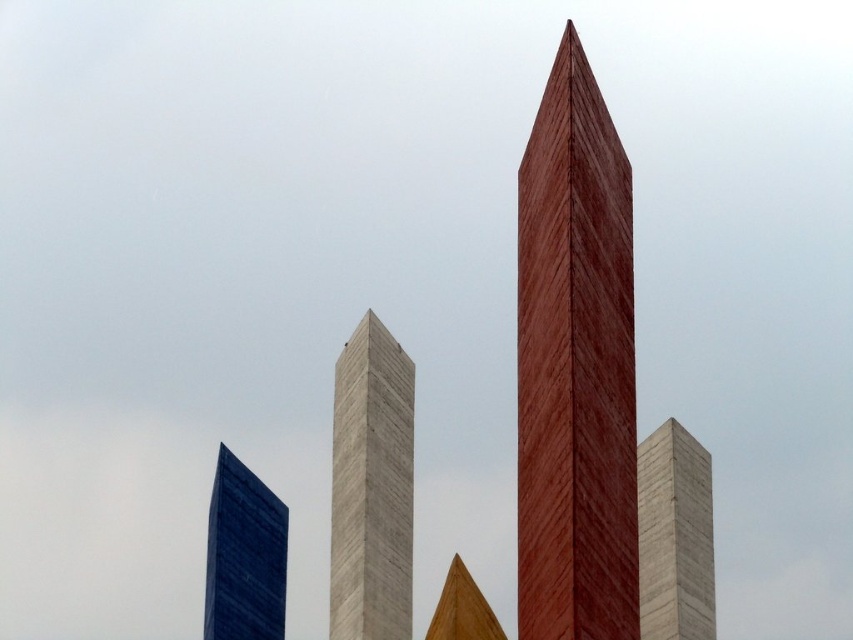
Who is lower down, wooden obelisk at center or gray concrete tower at center?

gray concrete tower at center is lower down.

Does wooden obelisk at center have a smaller size compared to gray concrete tower at center?

No, wooden obelisk at center is not smaller than gray concrete tower at center.

Is point (538, 541) more distant than point (345, 593)?

No, it is not.

Image resolution: width=853 pixels, height=640 pixels. Find the location of `wooden obelisk at center`. wooden obelisk at center is located at coordinates 575,368.

Can you confirm if gray concrete tower at center is positioned to the left of blue glass tower at lower left?

Incorrect, gray concrete tower at center is not on the left side of blue glass tower at lower left.

Does gray concrete tower at center have a greater height compared to blue glass tower at lower left?

Yes, gray concrete tower at center is taller than blue glass tower at lower left.

Between point (339, 529) and point (242, 513), which one is positioned behind?

The point (242, 513) is behind.

The height and width of the screenshot is (640, 853). In order to click on gray concrete tower at center in this screenshot , I will do `click(370, 486)`.

Can you confirm if wooden obelisk at center is taller than gray marble tower at center?

Yes.

What do you see at coordinates (575, 368) in the screenshot? I see `wooden obelisk at center` at bounding box center [575, 368].

Where is `wooden obelisk at center`? This screenshot has width=853, height=640. wooden obelisk at center is located at coordinates (575, 368).

This screenshot has height=640, width=853. Find the location of `wooden obelisk at center`. wooden obelisk at center is located at coordinates (575, 368).